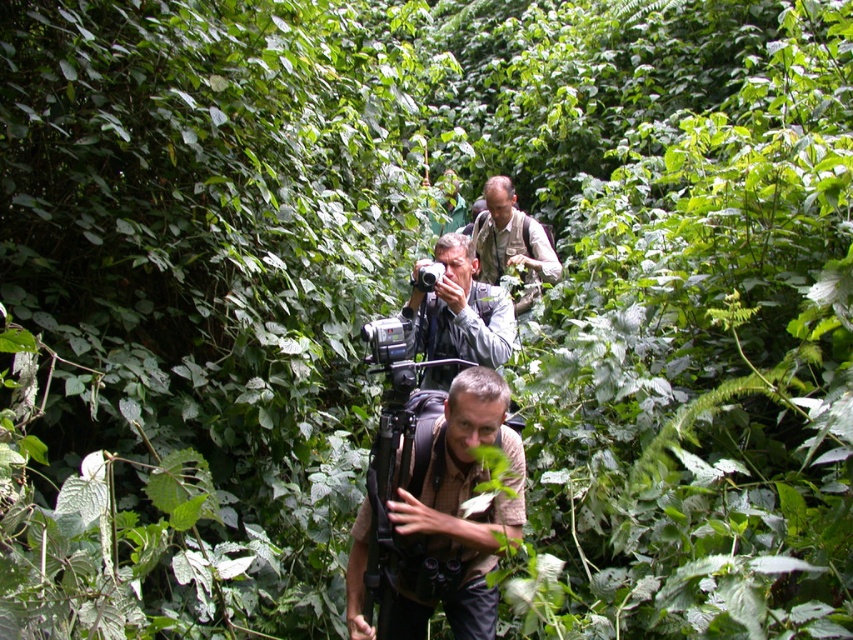
You are a photographer trying to adjust your matte gray camera at center and khaki fabric shirt at center. Which object should you move first to get a better angle?

The matte gray camera at center is to the left of khaki fabric shirt at center, so you should move the matte gray camera at center first to adjust its position for a better angle.

You are a hiker who wants to ensure your gear is properly packed. You have a brown fabric backpack at center and a matte gray camera at center. Which item should you place at the bottom of the backpack to prevent it from getting damaged?

The matte gray camera at center should be placed at the bottom of the brown fabric backpack at center because the backpack is taller, providing enough space to accommodate the camera safely without it being crushed by heavier items placed on top.

You are a photographer trying to capture a clear shot of the forest. You notice the matte gray camera at center and the khaki fabric shirt at center. Which object is closer to the camera lens?

The matte gray camera at center is in front of the khaki fabric shirt at center, so the matte gray camera at center is closer to the camera lens.